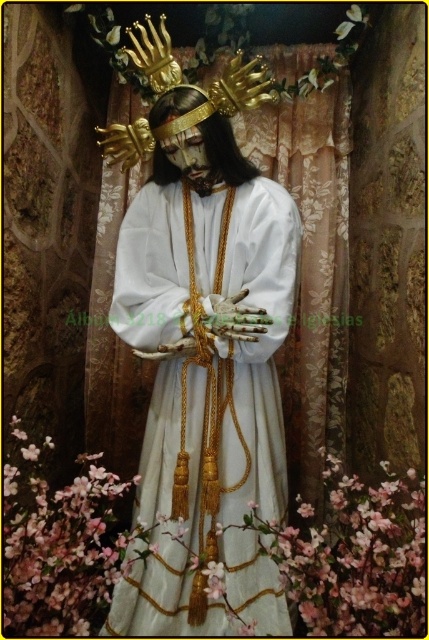
You are an art conservator examining the statue of Jesus Christ. You need to place a protective shield exactly at the location of the gold metallic crown at upper center. What are the 2D coordinates where you should position the shield?

The gold metallic crown at upper center is located at coordinates (180,88), so you should position the shield at those exact coordinates.

You are a photographer setting up for a portrait shoot. You have a white satin dress at center and a gold metallic crown at upper center in your frame. Which object will require more space to capture in full detail without cropping? Explain your reasoning based on their sizes.

The white satin dress at center requires more space because it has a larger size compared to the gold metallic crown at upper center, so to capture it in full detail without cropping, the photographer needs to adjust the framing to accommodate its bigger dimensions.

You are an interior designer planning to place a new statue in a room. The statue will be positioned at point (213, 369). According to the image, what object is currently occupying that location?

The white satin dress at center is located at point (213, 369), so that location is currently occupied by the white satin dress at center.